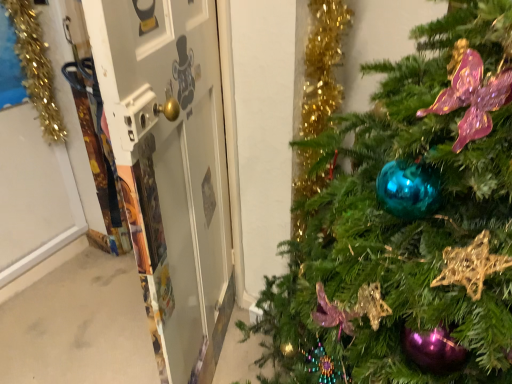
Question: Does metallic gold screen door at left have a greater width compared to shiny teal ornament at center-right?

Choices:
 (A) no
 (B) yes

Answer: (A)

Question: Can you confirm if metallic gold screen door at left is taller than shiny teal ornament at center-right?

Choices:
 (A) yes
 (B) no

Answer: (A)

Question: Is metallic gold screen door at left shorter than shiny teal ornament at center-right?

Choices:
 (A) no
 (B) yes

Answer: (A)

Question: Are metallic gold screen door at left and shiny teal ornament at center-right beside each other?

Choices:
 (A) yes
 (B) no

Answer: (B)

Question: Is shiny teal ornament at center-right completely or partially inside metallic gold screen door at left?

Choices:
 (A) no
 (B) yes

Answer: (A)

Question: Looking at the image, does gold tinsel garland at left seem bigger or smaller compared to metallic gold screen door at left?

Choices:
 (A) small
 (B) big

Answer: (A)

Question: Does point 44,56 appear closer or farther from the camera than point 211,230?

Choices:
 (A) farther
 (B) closer

Answer: (A)

Question: Which is correct: gold tinsel garland at left is inside metallic gold screen door at left, or outside of it?

Choices:
 (A) outside
 (B) inside

Answer: (A)

Question: From a real-world perspective, is gold tinsel garland at left positioned above or below metallic gold screen door at left?

Choices:
 (A) below
 (B) above

Answer: (B)

Question: Is point (41, 59) closer or farther from the camera than point (416, 289)?

Choices:
 (A) closer
 (B) farther

Answer: (B)

Question: From the image's perspective, is gold tinsel garland at left above or below shiny teal ornament at center-right?

Choices:
 (A) below
 (B) above

Answer: (B)

Question: In terms of height, does gold tinsel garland at left look taller or shorter compared to shiny teal ornament at center-right?

Choices:
 (A) short
 (B) tall

Answer: (A)

Question: Is gold tinsel garland at left to the left or to the right of shiny teal ornament at center-right in the image?

Choices:
 (A) right
 (B) left

Answer: (B)

Question: Considering the positions of shiny teal ornament at center-right and metallic gold screen door at left in the image, is shiny teal ornament at center-right bigger or smaller than metallic gold screen door at left?

Choices:
 (A) big
 (B) small

Answer: (A)

Question: Is shiny teal ornament at center-right inside the boundaries of metallic gold screen door at left, or outside?

Choices:
 (A) outside
 (B) inside

Answer: (A)